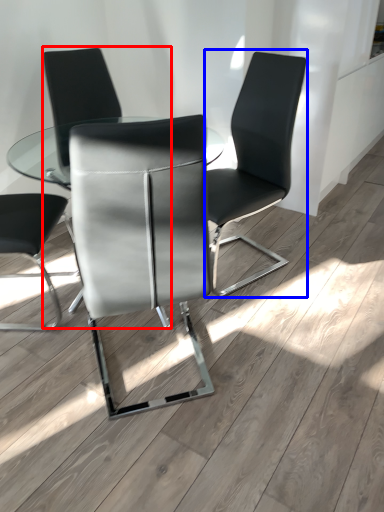
Question: Which point is closer to the camera, chair (highlighted by a red box) or chair (highlighted by a blue box)?

Choices:
 (A) chair
 (B) chair

Answer: (B)